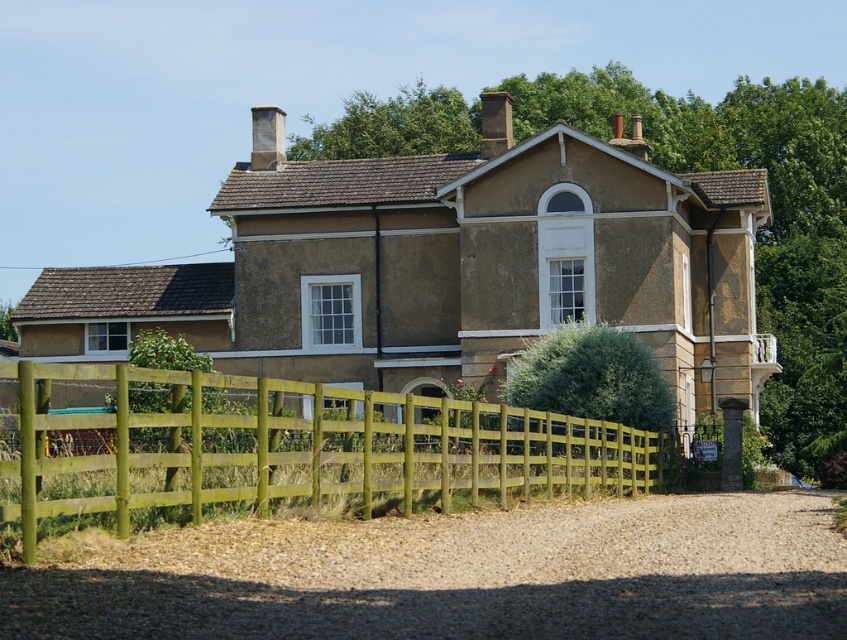
Based on the photo, who is positioned more to the right, gravelly dirt driveway at lower center or green wooden fence at lower center?

Positioned to the right is gravelly dirt driveway at lower center.

Between point (667, 589) and point (562, 451), which one is positioned in front?

Point (667, 589)

Is point (815, 588) closer to viewer compared to point (37, 490)?

Yes, it is.

I want to click on gravelly dirt driveway at lower center, so click(460, 576).